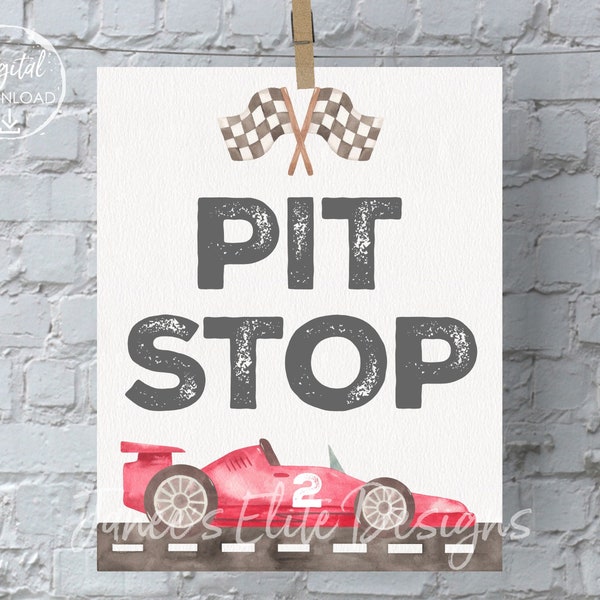
Locate an element on the screen. Image resolution: width=600 pixels, height=600 pixels. window is located at coordinates (336, 463).